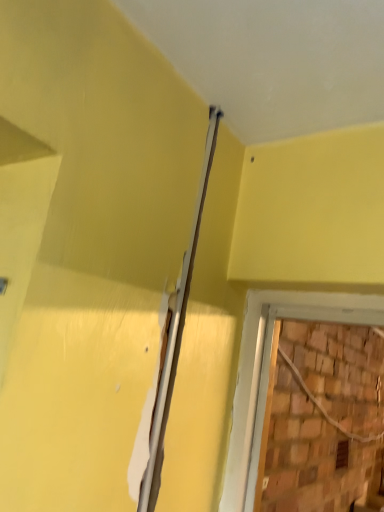
Question: Is brown wooden hole at lower right at the left side of white glossy beam at upper center?

Choices:
 (A) yes
 (B) no

Answer: (B)

Question: From the image's perspective, would you say brown wooden hole at lower right is shown under white glossy beam at upper center?

Choices:
 (A) yes
 (B) no

Answer: (A)

Question: Does brown wooden hole at lower right have a greater height compared to white glossy beam at upper center?

Choices:
 (A) yes
 (B) no

Answer: (B)

Question: Is brown wooden hole at lower right closer to camera compared to white glossy beam at upper center?

Choices:
 (A) no
 (B) yes

Answer: (A)

Question: Considering the relative positions of brown wooden hole at lower right and white glossy beam at upper center in the image provided, is brown wooden hole at lower right to the right of white glossy beam at upper center from the viewer's perspective?

Choices:
 (A) yes
 (B) no

Answer: (A)

Question: Considering the relative sizes of brown wooden hole at lower right and white glossy beam at upper center in the image provided, is brown wooden hole at lower right smaller than white glossy beam at upper center?

Choices:
 (A) no
 (B) yes

Answer: (A)

Question: From the image's perspective, is white glossy beam at upper center on top of brown wooden hole at lower right?

Choices:
 (A) yes
 (B) no

Answer: (A)

Question: Does white glossy beam at upper center appear on the left side of brown wooden hole at lower right?

Choices:
 (A) yes
 (B) no

Answer: (A)

Question: Considering the relative sizes of white glossy beam at upper center and brown wooden hole at lower right in the image provided, is white glossy beam at upper center smaller than brown wooden hole at lower right?

Choices:
 (A) no
 (B) yes

Answer: (B)

Question: Is white glossy beam at upper center wider than brown wooden hole at lower right?

Choices:
 (A) no
 (B) yes

Answer: (A)

Question: Would you say white glossy beam at upper center is outside brown wooden hole at lower right?

Choices:
 (A) yes
 (B) no

Answer: (A)

Question: From the image's perspective, is white glossy beam at upper center beneath brown wooden hole at lower right?

Choices:
 (A) yes
 (B) no

Answer: (B)

Question: Considering the relative positions of white glossy beam at upper center and brown wooden hole at lower right in the image provided, is white glossy beam at upper center to the left or to the right of brown wooden hole at lower right?

Choices:
 (A) left
 (B) right

Answer: (A)